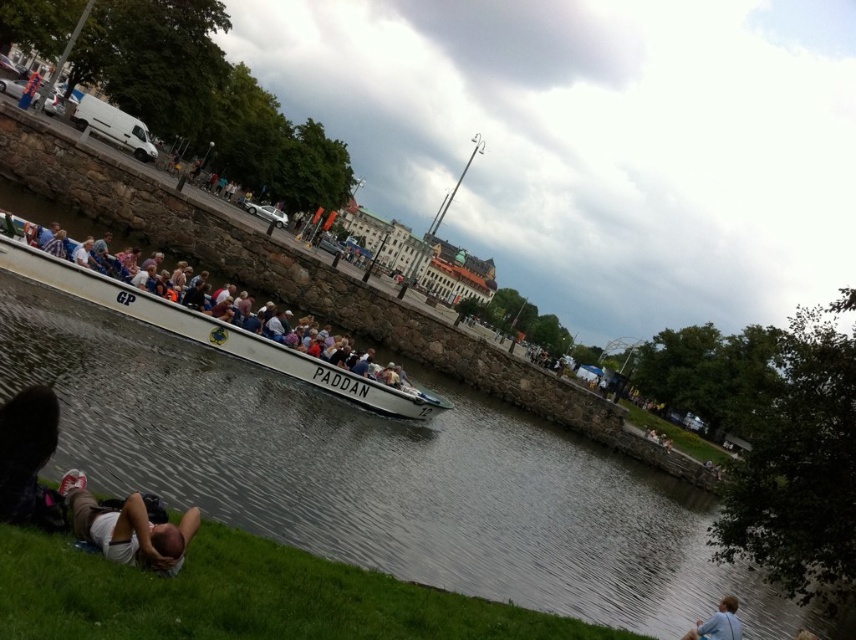
Consider the image. You are a photographer standing at the riverside. You want to take a photo of the white fabric person at lower left and the green grass at lower left. Which object is taller in the image?

The green grass at lower left is much taller than the white fabric person at lower left according to the description.

Consider the image. You are a photographer standing on the riverside. You want to take a photo of the blue fabric shirt at lower right without the white matte boat at center blocking the view. Is it possible?

The blue fabric shirt at lower right is behind the white matte boat at center, so it would be blocked from view. You cannot take a photo of the blue fabric shirt at lower right without the white matte boat at center blocking the view.